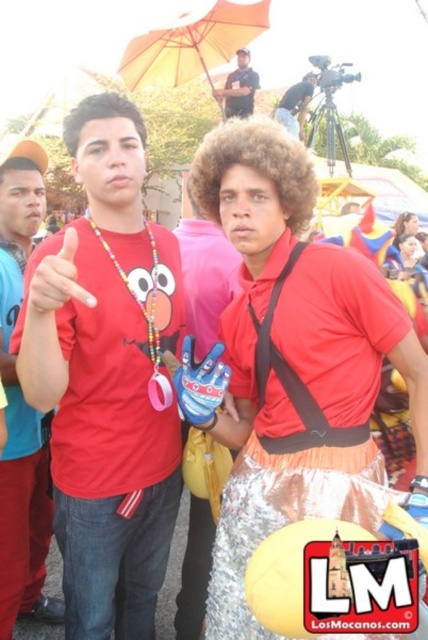
Question: Does shiny metallic skirt at center come in front of matte black shirt at upper center?

Choices:
 (A) no
 (B) yes

Answer: (B)

Question: Can you confirm if shiny metallic costume at center is positioned above matte black shirt at upper center?

Choices:
 (A) no
 (B) yes

Answer: (A)

Question: Which point is closer to the camera?

Choices:
 (A) (290, 88)
 (B) (5, 212)
 (C) (118, 269)
 (D) (243, 97)

Answer: (C)

Question: Does brushed metal necklace at left have a greater width compared to matte black shirt at upper center?

Choices:
 (A) no
 (B) yes

Answer: (A)

Question: Which point is farther from the camera taking this photo?

Choices:
 (A) (27, 285)
 (B) (205, 513)
 (C) (278, 116)
 (D) (228, 493)

Answer: (C)

Question: Which point is farther to the camera?

Choices:
 (A) (231, 109)
 (B) (139, 145)
 (C) (332, 308)
 (D) (8, 557)

Answer: (A)